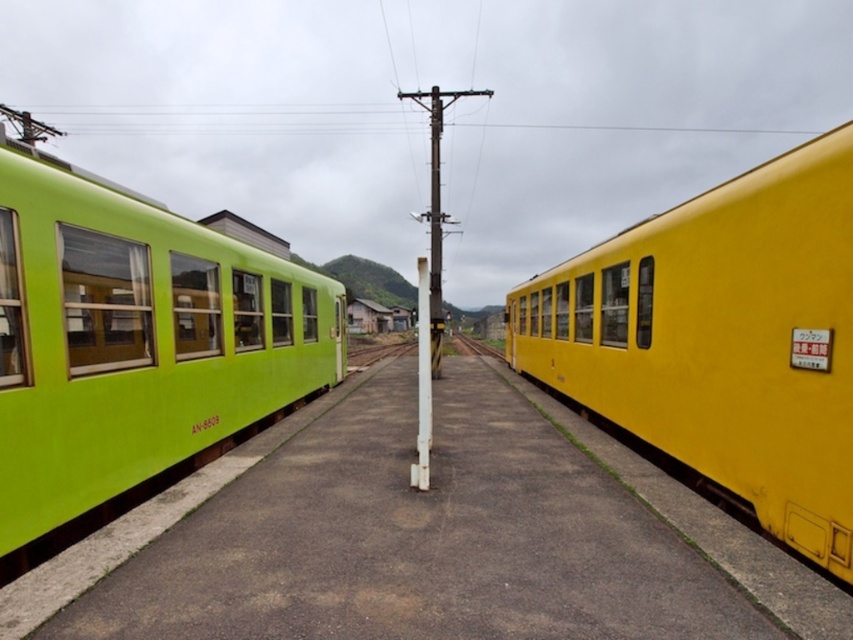
Question: Can you confirm if matte green train at left is positioned to the left of smooth metal train track at center?

Choices:
 (A) no
 (B) yes

Answer: (B)

Question: Which object is the closest to the smooth concrete train track at center?

Choices:
 (A) smooth metal train track at center
 (B) yellow matte train at right
 (C) matte green train at left

Answer: (A)

Question: Can you confirm if matte green train at left is smaller than smooth concrete train track at center?

Choices:
 (A) no
 (B) yes

Answer: (B)

Question: Estimate the real-world distances between objects in this image. Which object is closer to the smooth concrete train track at center?

Choices:
 (A) matte green train at left
 (B) smooth metal train track at center
 (C) yellow matte train at right
 (D) lime green plastic train at left

Answer: (B)

Question: Can you confirm if matte green train at left is positioned to the left of smooth metal train track at center?

Choices:
 (A) yes
 (B) no

Answer: (A)

Question: Which point is farther to the camera?

Choices:
 (A) yellow matte train at right
 (B) matte green train at left

Answer: (A)